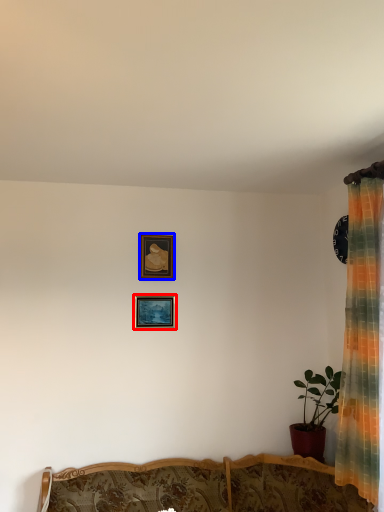
Question: Which object appears closest to the camera in this image, picture frame (highlighted by a red box) or picture frame (highlighted by a blue box)?

Choices:
 (A) picture frame
 (B) picture frame

Answer: (A)